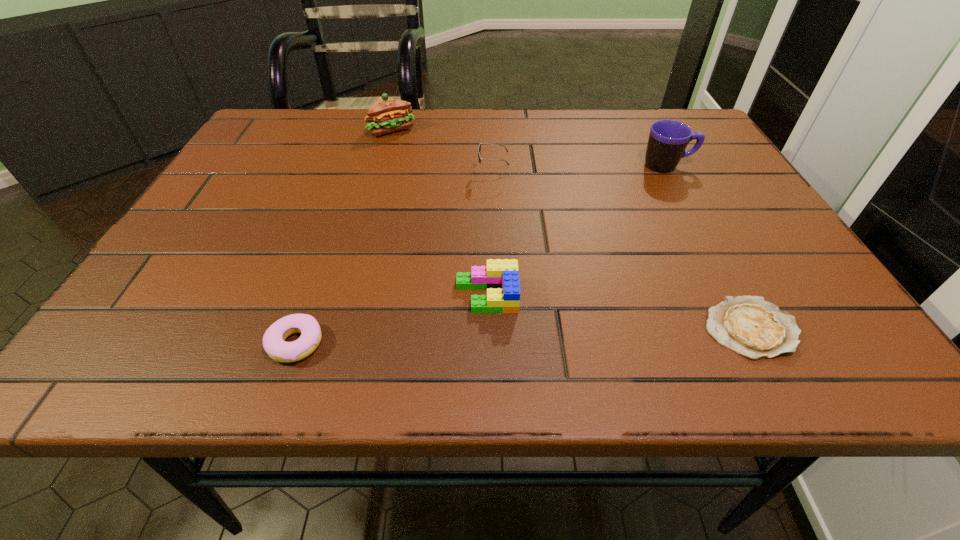
In the image, there is a desktop. At what (x,y) coordinates should I click in order to perform the action: click on blank space at the near edge. Please return your answer as a coordinate pair (x, y). Image resolution: width=960 pixels, height=540 pixels. Looking at the image, I should click on (340, 362).

Identify the location of vacant region at the left edge of the desktop. The image size is (960, 540). (188, 296).

In order to click on vacant space at the right edge in this screenshot , I will do `click(766, 299)`.

In the image, there is a desktop. At what (x,y) coordinates should I click in order to perform the action: click on vacant space at the near left corner. Please return your answer as a coordinate pair (x, y). The width and height of the screenshot is (960, 540). Looking at the image, I should click on (173, 354).

The width and height of the screenshot is (960, 540). Identify the location of vacant point at the far right corner. (661, 119).

Image resolution: width=960 pixels, height=540 pixels. In the image, there is a desktop. Find the location of `free region at the near right corner`. free region at the near right corner is located at coordinates (826, 369).

The height and width of the screenshot is (540, 960). I want to click on free space that is in between the quiche and the third shortest object, so click(618, 312).

Locate an element on the screen. free point between the sunglasses and the quiche is located at coordinates (621, 251).

At what (x,y) coordinates should I click in order to perform the action: click on free area in between the farthest object and the mug. Please return your answer as a coordinate pair (x, y). Looking at the image, I should click on (530, 148).

The width and height of the screenshot is (960, 540). Identify the location of vacant area between the sandwich and the doughnut. click(344, 237).